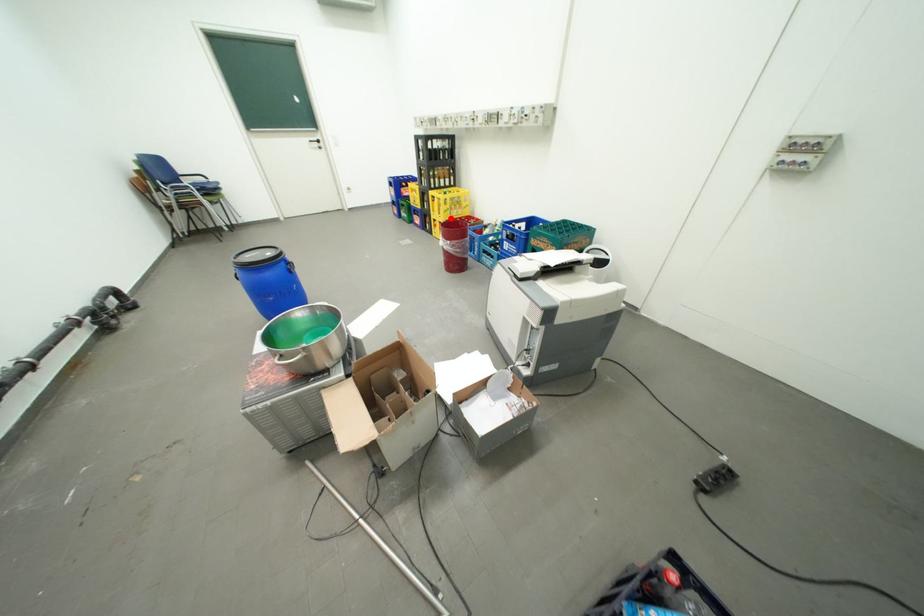
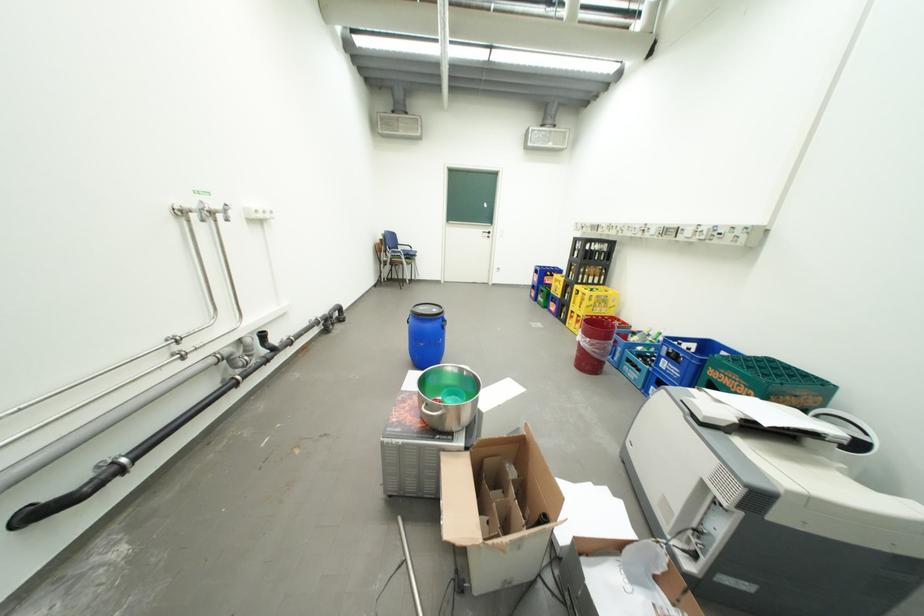
Find the pixel in the second image that matches the highlighted location in the first image.

(590, 312)